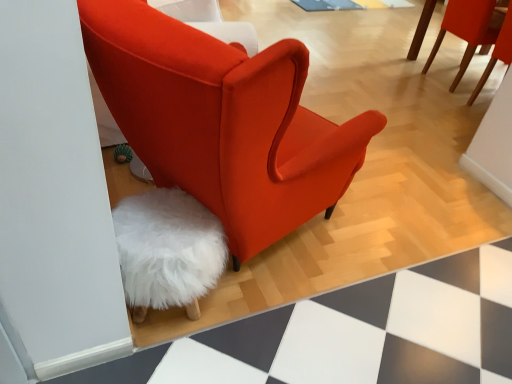
Where is `free spot to the right of white fluffy stool at lower left`? The image size is (512, 384). free spot to the right of white fluffy stool at lower left is located at coordinates (259, 332).